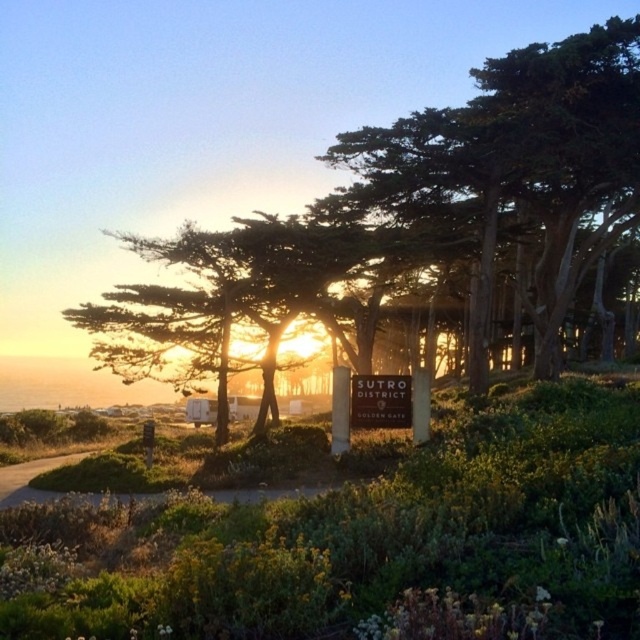
From the picture: You are a hiker trying to navigate through the coastal area. You see the green textured tree at center and the brown dirt path at lower left. Which one is wider?

The green textured tree at center is wider than the brown dirt path at lower left.

You are standing at the starting point of the pathway in the coastal scene. Looking towards the background, where would you see the green textured tree at center?

The green textured tree at center is located at the coordinates point (428, 208).

Based on the photo, you are a hiker walking along the coastal path and see the green textured tree at center and the white plastic sign at center ahead. Which object will appear bigger to you as you approach them?

The green textured tree at center will appear bigger as you approach because it has a larger size compared to the white plastic sign at center.